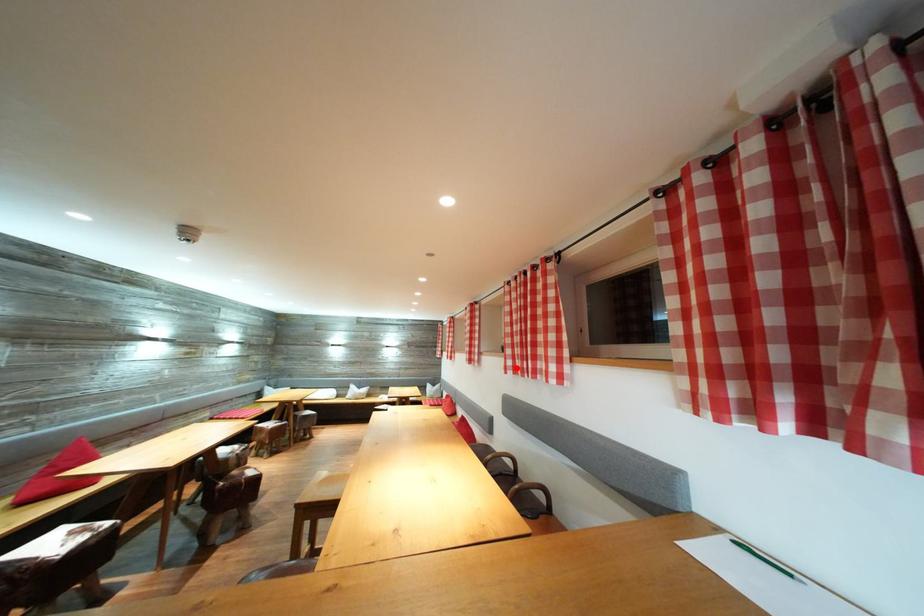
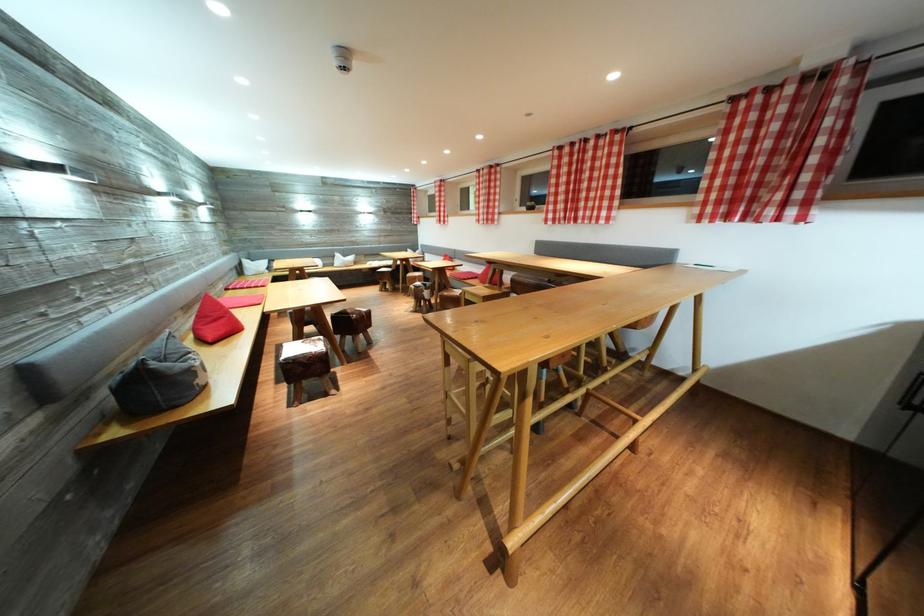
Question: A red point is marked in image1. In image2, is the corresponding 3D point closer to the camera or farther? Reply with the corresponding letter.

Choices:
 (A) The corresponding 3D point is closer.
 (B) The corresponding 3D point is farther.

Answer: (A)